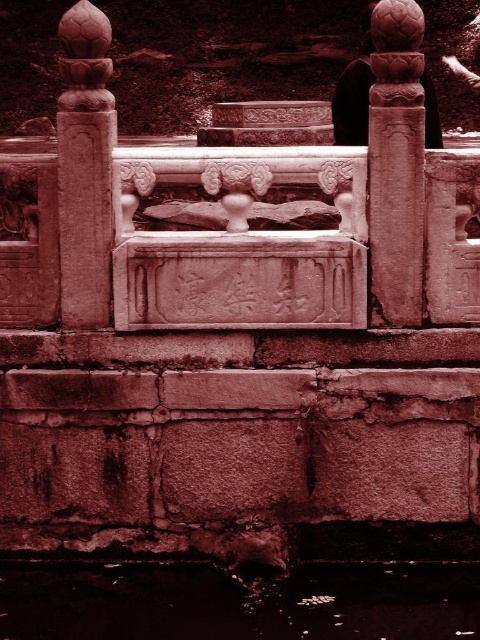
You are standing in front of the ornate stone structure and want to take a photo of the dark brown water at bottom and the smooth stone pillar at right. Which object is positioned closer to you?

The dark brown water at bottom is closer to the viewer than the smooth stone pillar at right.

Looking at this image, you are an architect examining the stone structure. You notice a point labeled as point (396, 164). Based on the structure described, which part of the stone structure does this point most likely correspond to?

The point (396, 164) corresponds to the smooth stone pillar at right.